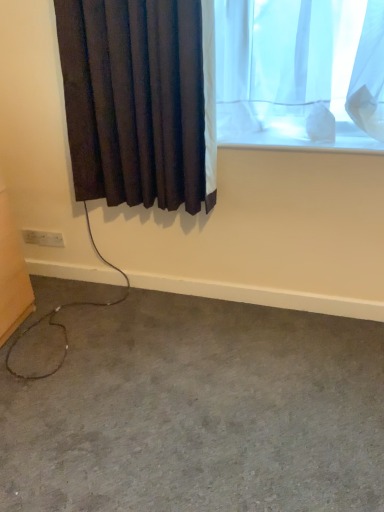
Question: Considering the relative sizes of gray carpet at lower left and dark fabric curtain at left in the image provided, is gray carpet at lower left wider than dark fabric curtain at left?

Choices:
 (A) no
 (B) yes

Answer: (B)

Question: Considering the relative sizes of gray carpet at lower left and dark fabric curtain at left in the image provided, is gray carpet at lower left shorter than dark fabric curtain at left?

Choices:
 (A) yes
 (B) no

Answer: (A)

Question: Is gray carpet at lower left oriented towards dark fabric curtain at left?

Choices:
 (A) no
 (B) yes

Answer: (A)

Question: Is the depth of gray carpet at lower left less than that of dark fabric curtain at left?

Choices:
 (A) no
 (B) yes

Answer: (B)

Question: Can dark fabric curtain at left be found inside gray carpet at lower left?

Choices:
 (A) yes
 (B) no

Answer: (B)

Question: From the image's perspective, is gray carpet at lower left located above dark fabric curtain at left?

Choices:
 (A) yes
 (B) no

Answer: (B)

Question: Is gray carpet at lower left turned away from white plastic electric outlet at lower left?

Choices:
 (A) no
 (B) yes

Answer: (A)

Question: Considering the relative positions of gray carpet at lower left and white plastic electric outlet at lower left in the image provided, is gray carpet at lower left to the right of white plastic electric outlet at lower left from the viewer's perspective?

Choices:
 (A) no
 (B) yes

Answer: (B)

Question: Would you say white plastic electric outlet at lower left is part of gray carpet at lower left's contents?

Choices:
 (A) no
 (B) yes

Answer: (A)

Question: Considering the relative sizes of gray carpet at lower left and white plastic electric outlet at lower left in the image provided, is gray carpet at lower left taller than white plastic electric outlet at lower left?

Choices:
 (A) no
 (B) yes

Answer: (A)

Question: Is gray carpet at lower left not close to white plastic electric outlet at lower left?

Choices:
 (A) no
 (B) yes

Answer: (B)

Question: Does gray carpet at lower left have a greater width compared to white plastic electric outlet at lower left?

Choices:
 (A) yes
 (B) no

Answer: (A)

Question: Is dark fabric curtain at left outside of white plastic electric outlet at lower left?

Choices:
 (A) no
 (B) yes

Answer: (B)